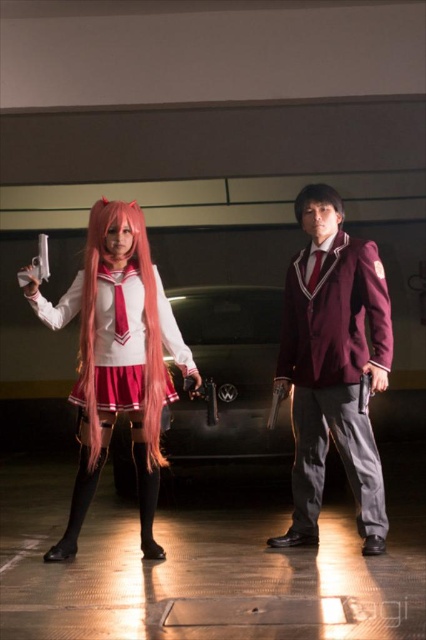
You are a photographer standing in front of the two cosplayers in the parking garage. You want to take a photo that includes both of them clearly. Which point, point 1 at coordinates [322,424] or point 2 at coordinates [155,326], should you focus on to ensure both are in focus?

You should focus on point 1 at coordinates [322,424] because it is further to the camera than point 2 at coordinates [155,326]. Focusing on the closer point might cause the farther subject to be out of focus, while focusing on the farther point can keep both in focus if within the depth of field.

You are a photographer trying to capture both the maroon fabric suit at center and the matte pink wig at center in a single frame. Given that your camera can only focus on objects within a 1.5 meter width, will both fit in the frame?

The maroon fabric suit at center is narrower than the matte pink wig at center. Since the camera can focus on objects within a 1.5 meter width, both objects can fit as long as their combined width does not exceed 1.5 meters. However, the exact fit depends on their individual widths and positioning.

You are a photographer setting up a shoot in a dimly lit parking garage. You need to ensure that both the matte pink wig at left and the matte pink wig at center are visible in your frame. Given that the camera you are using has a minimum width requirement of 10 cm to capture details clearly, can you confirm if both wigs meet this requirement?

The matte pink wig at left has a width less than the matte pink wig at center. Since the camera requires a minimum width of 10 cm, we cannot confirm if both meet the requirement without knowing the exact width of the wider wig. However, if the wider matte pink wig at center is at least 10 cm, then the narrower one might also meet the requirement depending on its specific measurement.